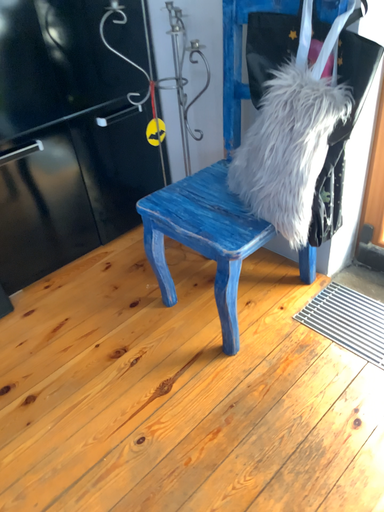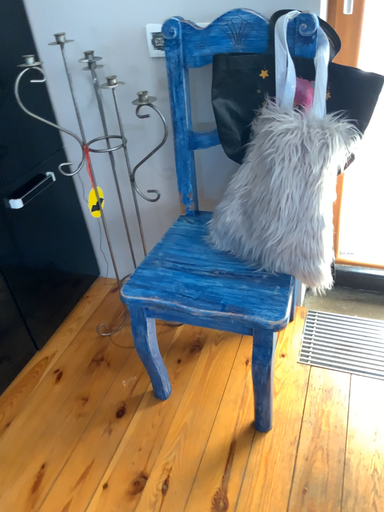
Question: How did the camera likely rotate when shooting the video?

Choices:
 (A) rotated right
 (B) rotated left

Answer: (A)